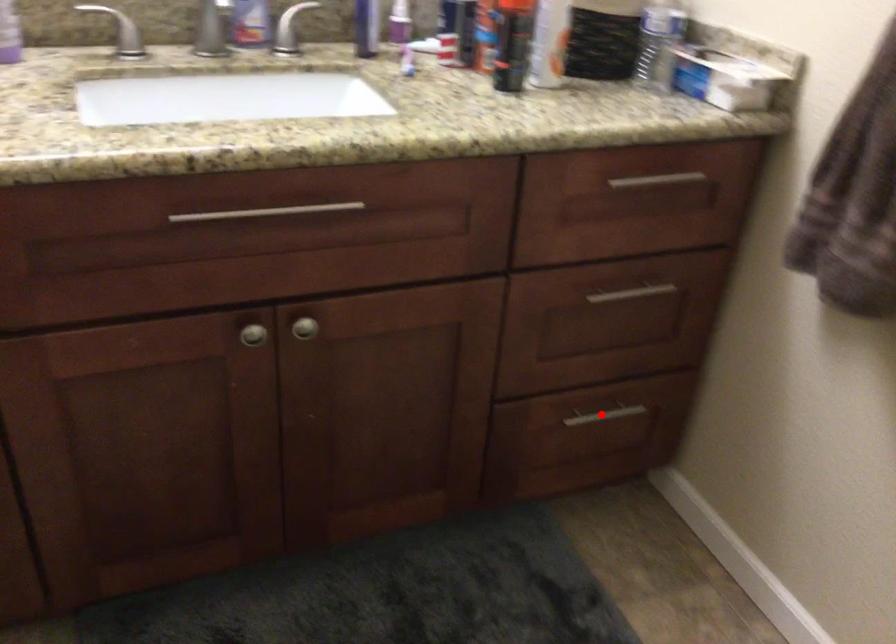
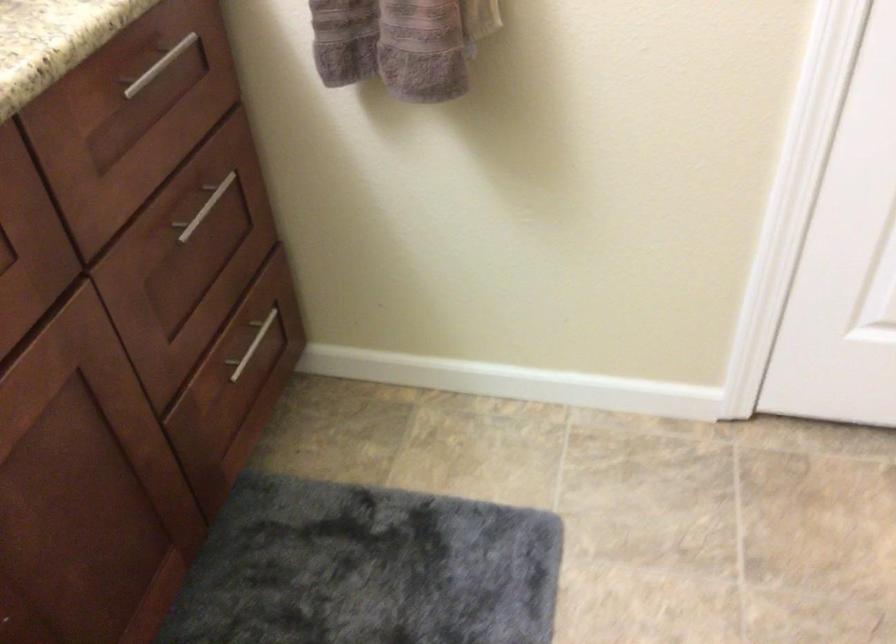
In the second image, find the point that corresponds to the highlighted location in the first image.

(252, 345)